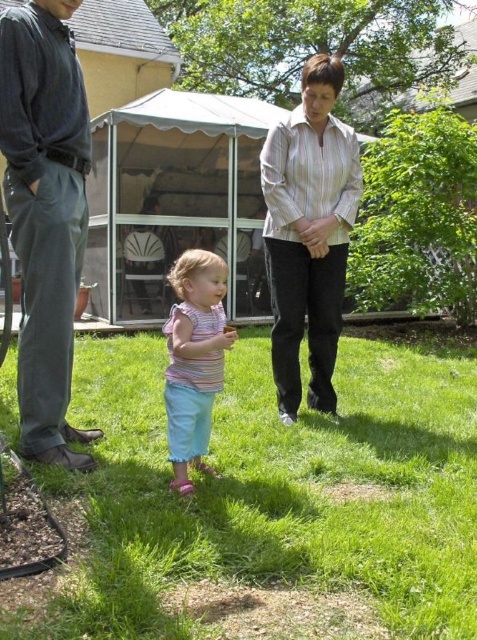
Does green grass at center lie in front of striped shirt at center?

Yes, green grass at center is closer to the viewer.

Does green grass at center have a greater width compared to striped shirt at center?

Yes, green grass at center is wider than striped shirt at center.

Does point (94, 477) come behind point (282, 401)?

No, it is in front of (282, 401).

Locate an element on the screen. green grass at center is located at coordinates click(x=280, y=488).

Who is more distant from viewer, (x=277, y=262) or (x=166, y=336)?

Positioned behind is point (x=166, y=336).

Consider the image. Between striped shirt at center and striped fabric shirt at center, which one is positioned higher?

striped shirt at center is higher up.

Is point (281, 260) closer to camera compared to point (188, 372)?

No, it is not.

Find the location of a particular element. This screenshot has height=640, width=477. striped shirt at center is located at coordinates (309, 234).

Between green grass at center and dark gray pants at left, which one appears on the left side from the viewer's perspective?

Positioned to the left is dark gray pants at left.

Is green grass at center positioned before dark gray pants at left?

Yes, green grass at center is closer to the viewer.

Is point (118, 483) closer to viewer compared to point (38, 122)?

Yes, it is in front of point (38, 122).

Locate an element on the screen. The image size is (477, 640). green grass at center is located at coordinates (280, 488).